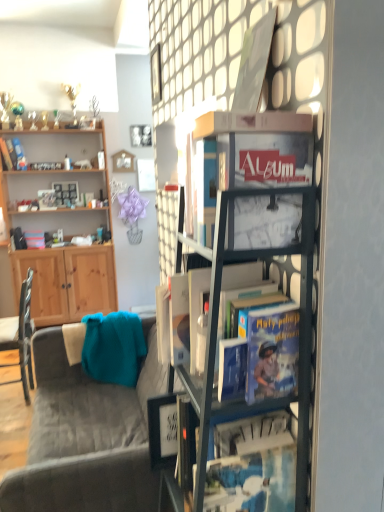
Question: Looking at their shapes, would you say metallic silver picture frame at upper center, which is the 1th picture frame in left-to-right order, is wider or thinner than wooden cabinet at left?

Choices:
 (A) thin
 (B) wide

Answer: (A)

Question: From the image's perspective, is metallic silver picture frame at upper center, which is counted as the third picture frame, starting from the front, positioned above or below wooden cabinet at left?

Choices:
 (A) above
 (B) below

Answer: (A)

Question: Which of these objects is positioned closest to the hardcover book at center, which appears as the second book when viewed from the top?

Choices:
 (A) matte white picture frame at upper center, the 5th picture frame when ordered from front to back
 (B) wooden cabinet at left
 (C) matte glass picture frame at upper center, which ranks as the fifth picture frame in back-to-front order
 (D) metallic silver picture frame at upper center, which is counted as the third picture frame, starting from the front
 (E) velvet grey couch at lower left

Answer: (C)

Question: Which is farther from the matte white picture frame at upper center, the 5th picture frame when ordered from front to back?

Choices:
 (A) hardcover book at center, which appears as the second book when viewed from the top
 (B) matte glass picture frame at upper center, placed as the fifth picture frame when sorted from left to right
 (C) velvet grey couch at lower left
 (D) metallic silver picture frame at upper center, the second picture frame from the front
 (E) metallic silver picture frame at upper center, which is counted as the 5th picture frame, starting from the right

Answer: (A)